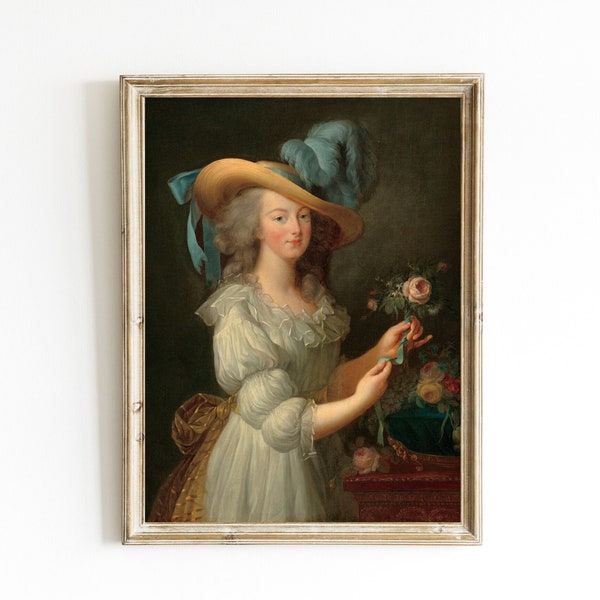
You are a GUI agent. You are given a task and a screenshot of the screen. Output one action in this format:
    pyautogui.click(x=<x>, y=<y>)
    Task: Click on the picture frame
    
    Given the screenshot: What is the action you would take?
    pyautogui.click(x=135, y=517), pyautogui.click(x=315, y=87), pyautogui.click(x=476, y=282), pyautogui.click(x=325, y=536)